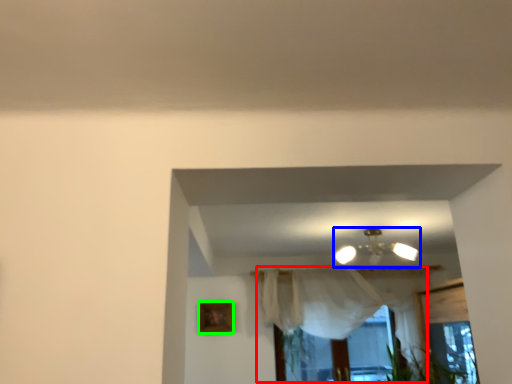
Question: Which is farther away from curtain (highlighted by a red box)? lamp (highlighted by a blue box) or picture frame (highlighted by a green box)?

Choices:
 (A) lamp
 (B) picture frame

Answer: (B)